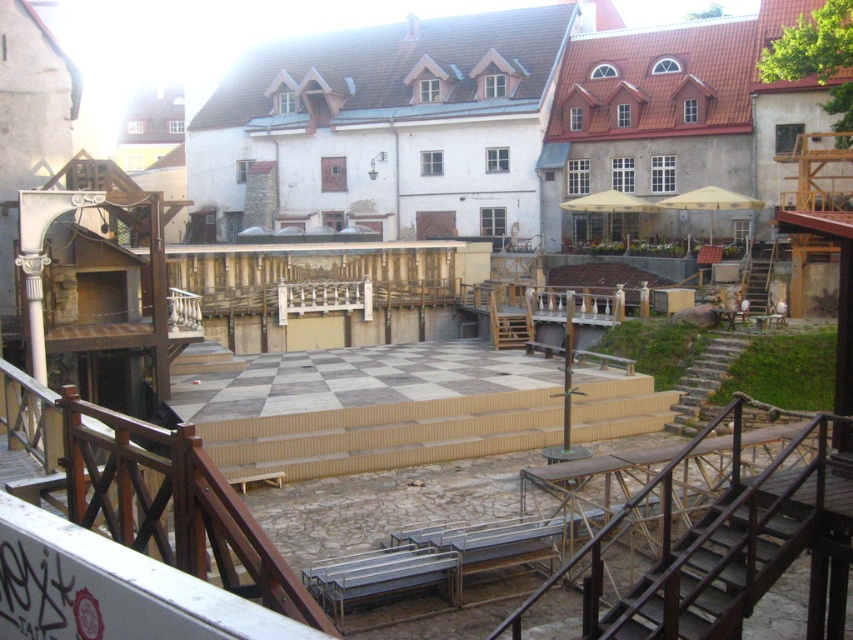
You are standing at point (703,380) in the courtyard. What is located at that exact point?

At point (703,380) lies stone stairs at right.

You are a visitor who wants to climb the stairs at the right side of the courtyard. There are two options available, the stone stairs at right and the wooden stairs at right. Which one takes up more space in the courtyard?

The wooden stairs at right takes up more space in the courtyard because the stone stairs at right occupies less space than wooden stairs at right.

You are standing at the base of the stairs in this historical site. You need to climb up to the platform. Which set of stairs, the dark brown wooden stairs at lower right or the wooden stairs at right, requires fewer steps to reach the platform?

The dark brown wooden stairs at lower right requires fewer steps to reach the platform because it has a lesser height compared to the wooden stairs at right.